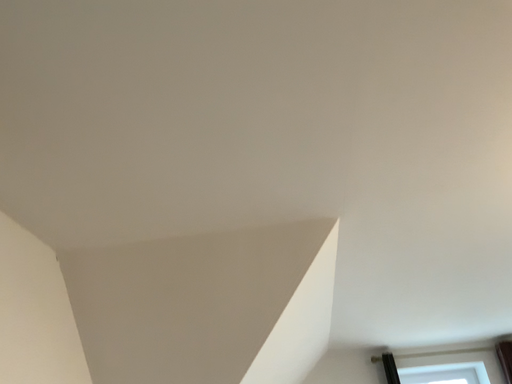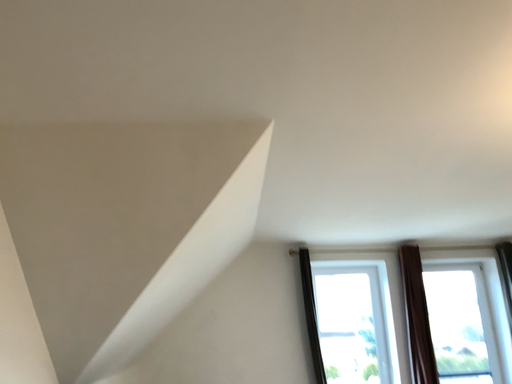
Question: How did the camera likely rotate when shooting the video?

Choices:
 (A) rotated downward
 (B) rotated upward

Answer: (A)